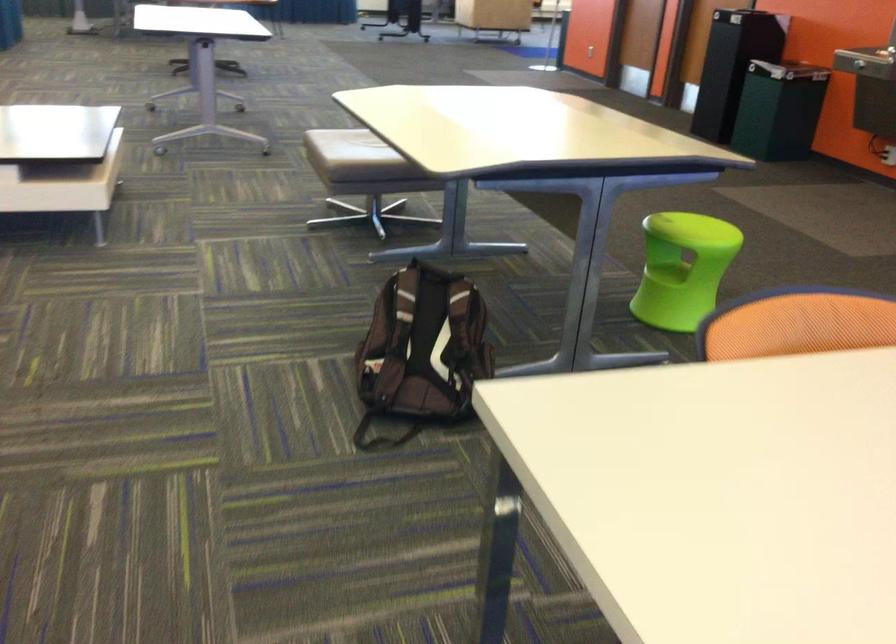
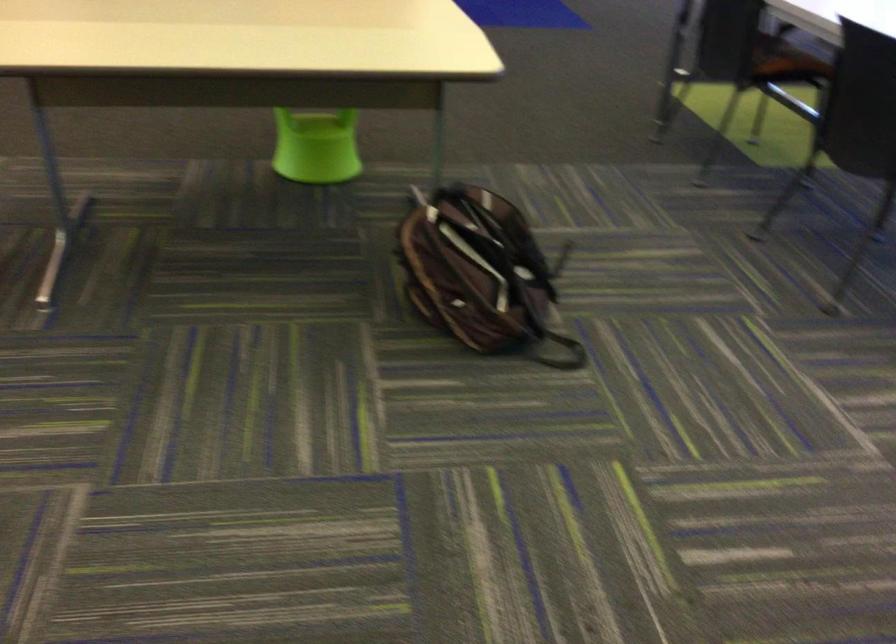
Find the pixel in the second image that matches pixel 398 335 in the first image.

(479, 272)